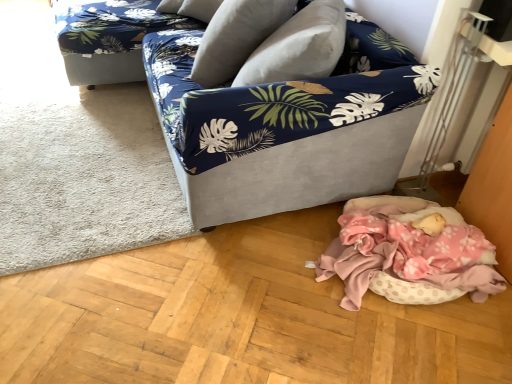
Where is `vacant area situated below white soft rug at lower left (from a real-world perspective)`? This screenshot has width=512, height=384. vacant area situated below white soft rug at lower left (from a real-world perspective) is located at coordinates (68, 152).